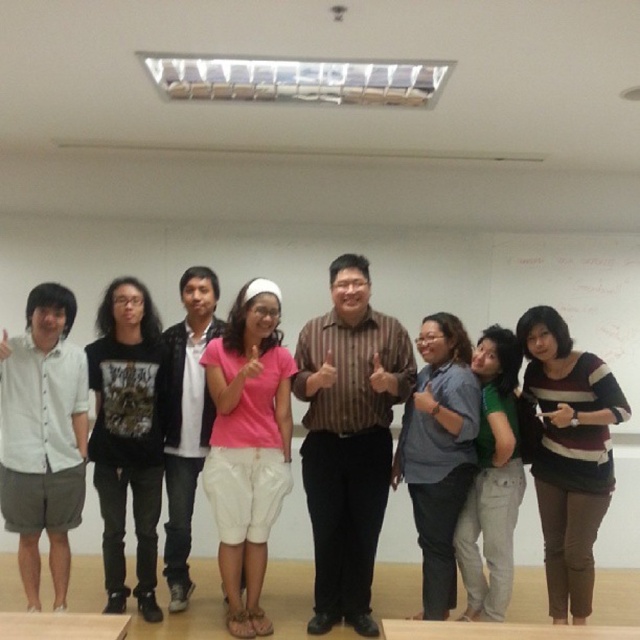
You are a photographer taking a group photo. You notice the blue shirt at center and the green cotton shirt at center. Which one is positioned higher in the image?

The blue shirt at center is positioned higher than the green cotton shirt at center according to the description.

You are standing in the classroom and see the point at coordinates (348, 438). Which object does this point lie on?

The point at coordinates (348, 438) lies on the brown striped shirt at center.